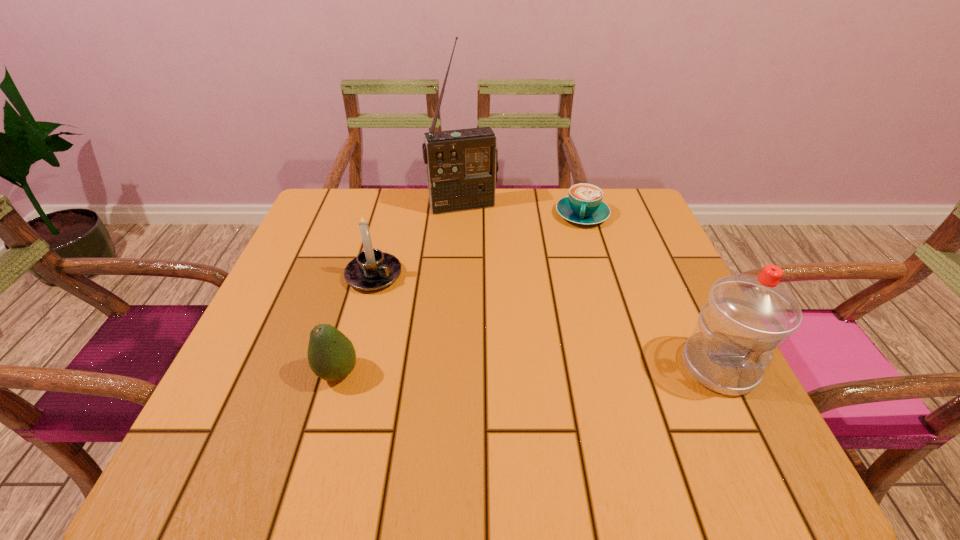
In order to click on free point located with a handle on the side of the third tallest object in this screenshot , I will do `click(474, 336)`.

This screenshot has height=540, width=960. What are the coordinates of `free region located with a handle on the side of the third tallest object` in the screenshot? It's located at (463, 329).

You are a GUI agent. You are given a task and a screenshot of the screen. Output one action in this format:
    pyautogui.click(x=<x>, y=<y>)
    Task: Click on the vacant area situated 0.120m with a handle on the side of the third tallest object
    The width and height of the screenshot is (960, 540).
    Given the screenshot: What is the action you would take?
    pyautogui.click(x=434, y=311)

Where is `vacant space located with the handle on the right side of the cappuccino`? This screenshot has height=540, width=960. vacant space located with the handle on the right side of the cappuccino is located at coordinates (575, 251).

The height and width of the screenshot is (540, 960). Identify the location of vacant space situated 0.230m with the handle on the right side of the cappuccino. (568, 288).

Image resolution: width=960 pixels, height=540 pixels. I want to click on vacant space located with the handle on the right side of the cappuccino, so click(569, 282).

Image resolution: width=960 pixels, height=540 pixels. Identify the location of vacant region located on the display of the tallest object. (492, 269).

Locate an element on the screen. free location located on the display of the tallest object is located at coordinates (500, 292).

At what (x,y) coordinates should I click in order to perform the action: click on free spot located on the display of the tallest object. Please return your answer as a coordinate pair (x, y). Looking at the image, I should click on (483, 248).

Identify the location of cappuccino present at the far edge. The image size is (960, 540). (584, 205).